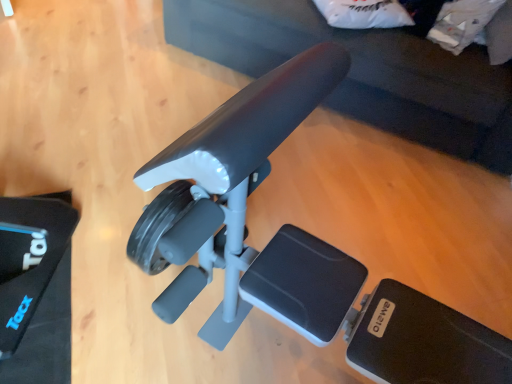
This screenshot has height=384, width=512. What do you see at coordinates (365, 72) in the screenshot?
I see `black leather couch at upper center` at bounding box center [365, 72].

Identify the location of black leather couch at upper center. The image size is (512, 384). (365, 72).

This screenshot has height=384, width=512. What are the coordinates of `black leather couch at upper center` in the screenshot? It's located at (365, 72).